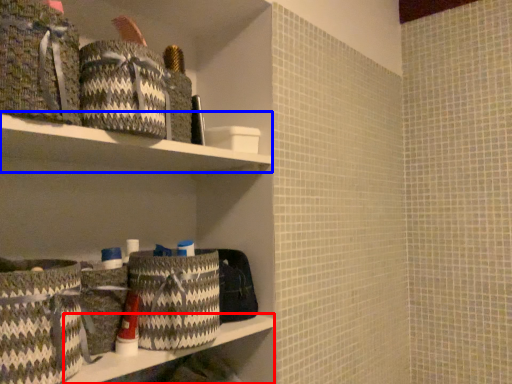
Question: Which of the following is the closest to the observer, ledge (highlighted by a red box) or cabinet (highlighted by a blue box)?

Choices:
 (A) ledge
 (B) cabinet

Answer: (B)